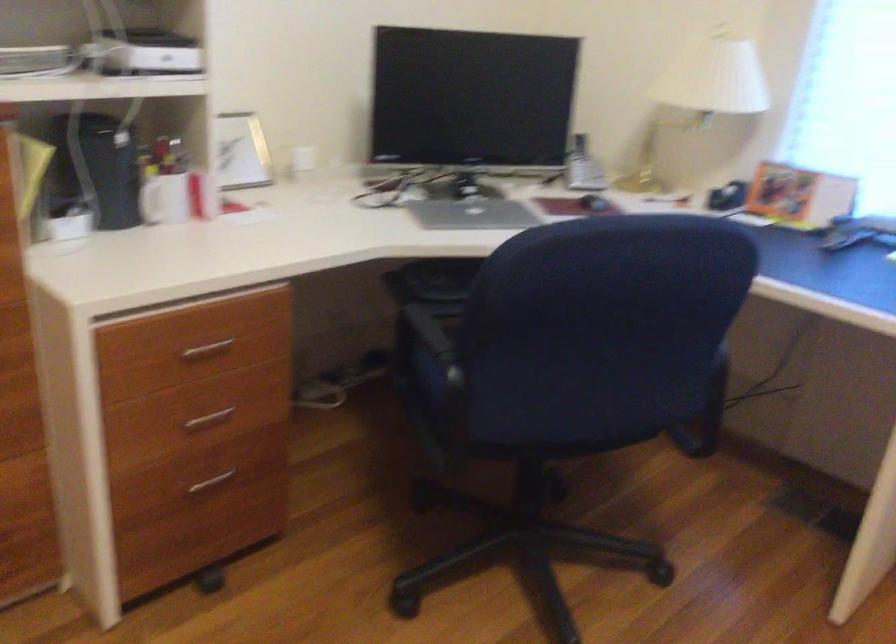
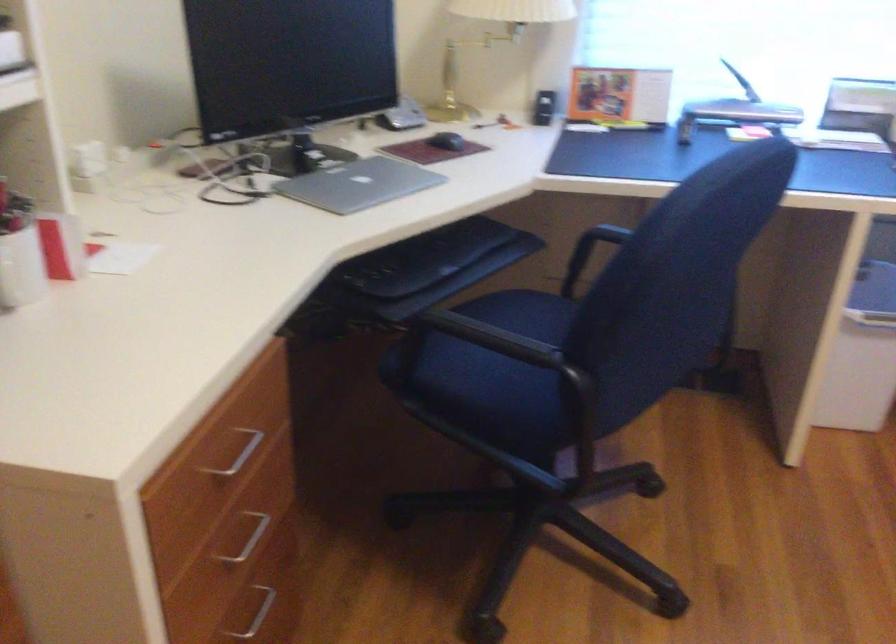
Locate, in the second image, the point that corresponds to (x=211, y=348) in the first image.

(238, 453)